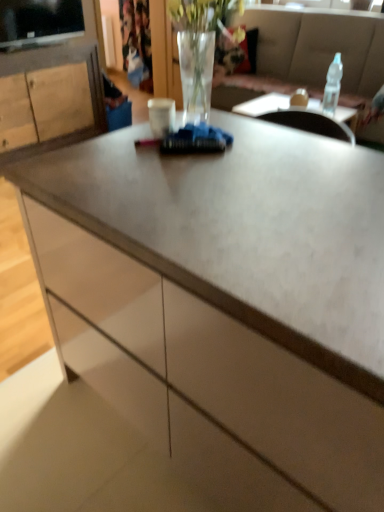
Identify the location of free space in front of clear glass vase at center. (213, 151).